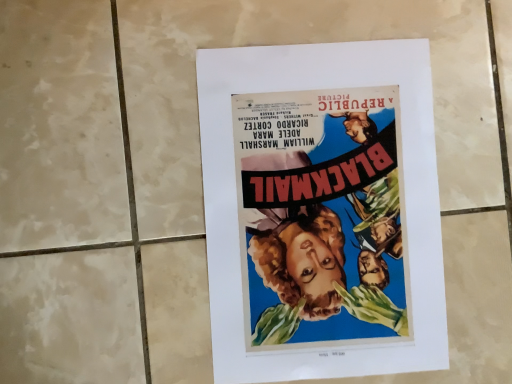
I want to click on vibrant paper poster at center, so click(321, 211).

Describe the element at coordinates (321, 211) in the screenshot. I see `vibrant paper poster at center` at that location.

Identify the location of vibrant paper poster at center. (321, 211).